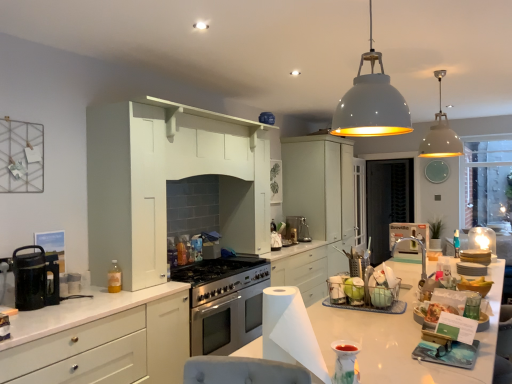
Find the location of a particular element. empty space that is ontop of clear glass window at right (from a real-world perspective) is located at coordinates (488, 130).